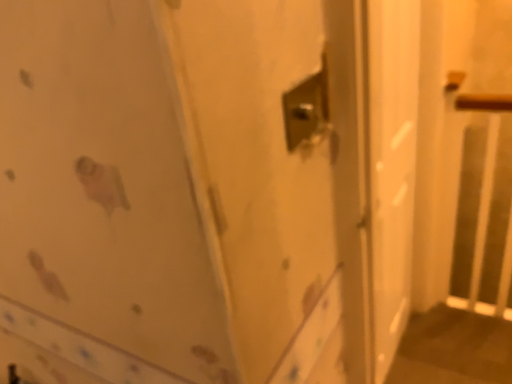
What do you see at coordinates (391, 168) in the screenshot? I see `white glossy screen door at right` at bounding box center [391, 168].

The height and width of the screenshot is (384, 512). I want to click on white glossy screen door at right, so click(x=391, y=168).

Where is `white glossy screen door at right`? This screenshot has width=512, height=384. white glossy screen door at right is located at coordinates (391, 168).